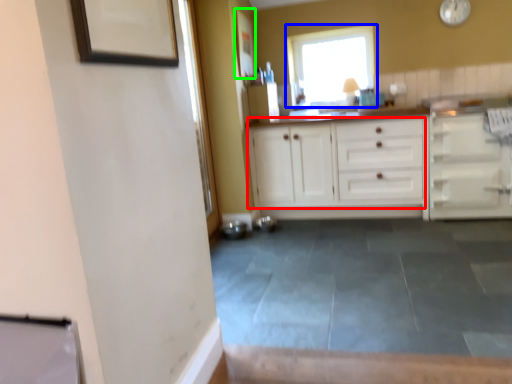
Question: Estimate the real-world distances between objects in this image. Which object is farther from cabinetry (highlighted by a red box), window (highlighted by a blue box) or picture frame (highlighted by a green box)?

Choices:
 (A) window
 (B) picture frame

Answer: (B)